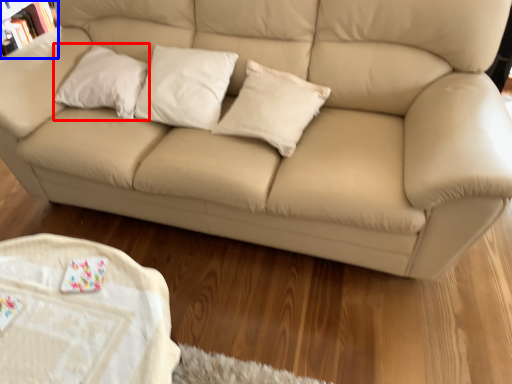
Question: Which object appears closest to the camera in this image, pillow (highlighted by a red box) or bookcase (highlighted by a blue box)?

Choices:
 (A) pillow
 (B) bookcase

Answer: (A)